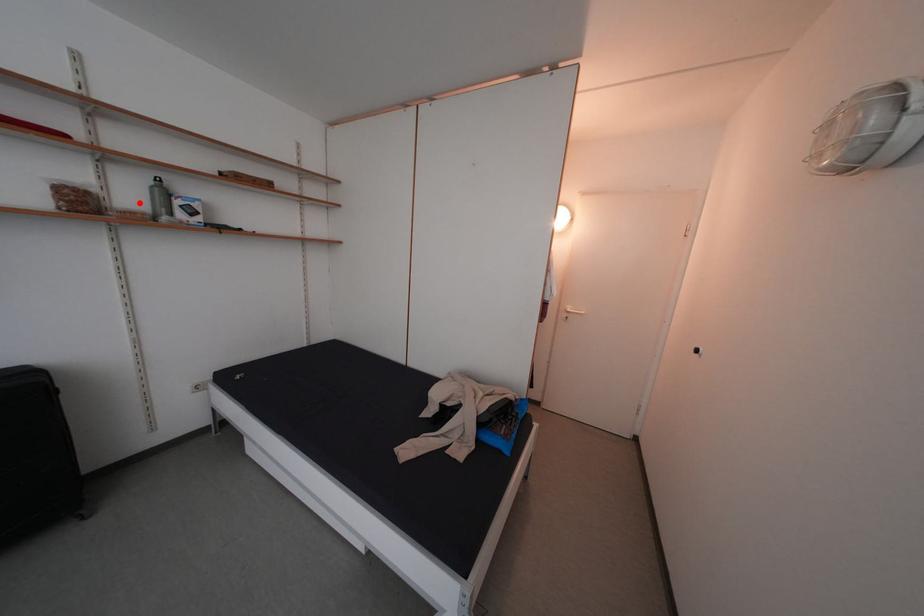
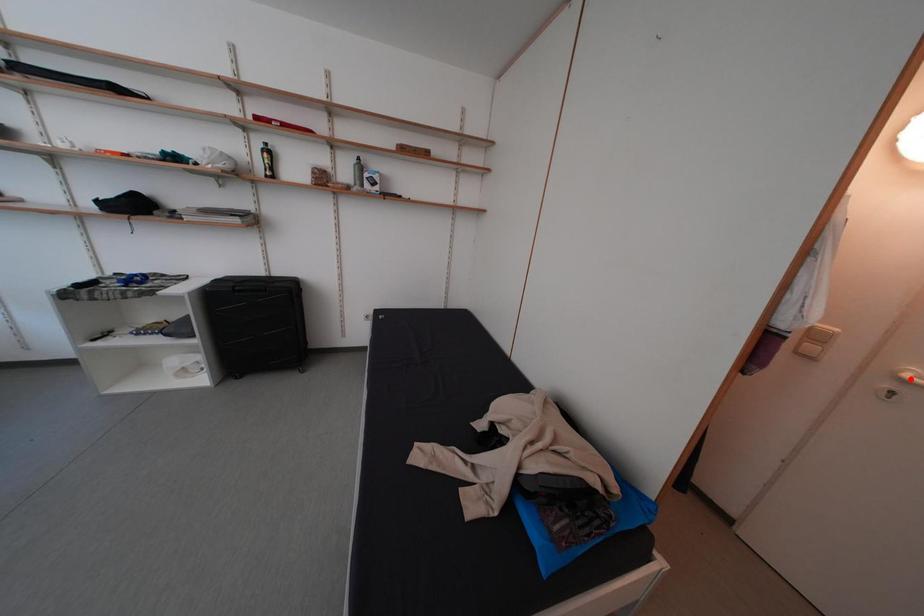
I am providing you with two images of the same scene from different viewpoints. A red point is marked on the first image and another point is marked on the second image. Does the point marked in image1 correspond to the same location as the one in image2?

No